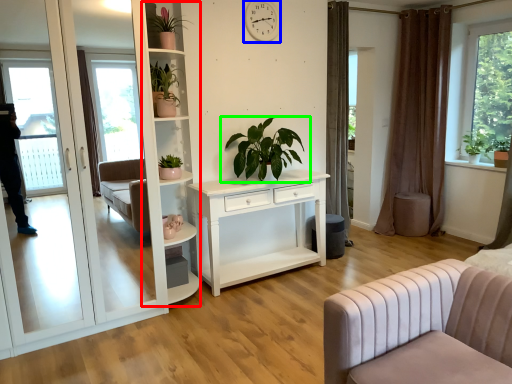
Question: Based on their relative distances, which object is farther from bookshelf (highlighted by a red box)? Choose from clock (highlighted by a blue box) and houseplant (highlighted by a green box).

Choices:
 (A) clock
 (B) houseplant

Answer: (A)